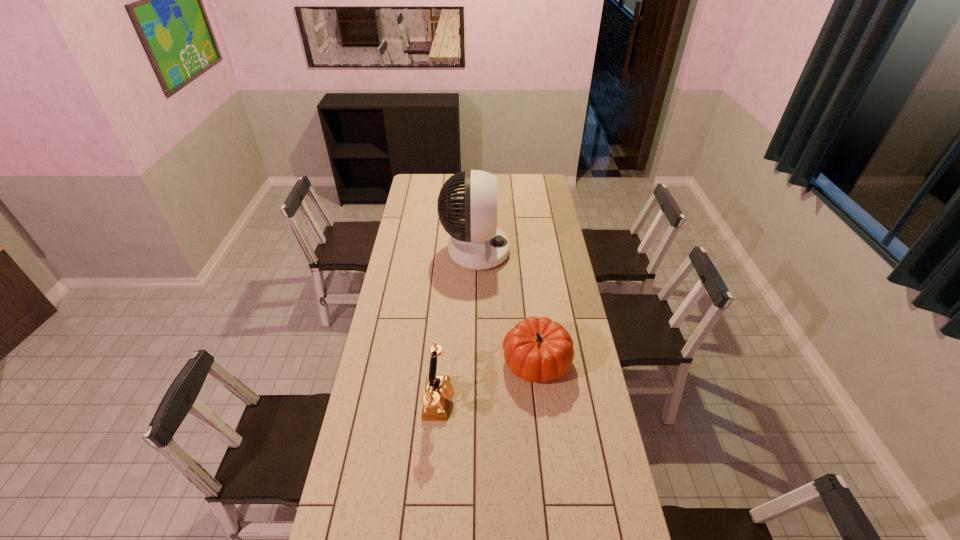
This screenshot has width=960, height=540. In order to click on the tallest object in this screenshot , I will do `click(470, 218)`.

What are the coordinates of `fan` in the screenshot? It's located at [470, 218].

What are the coordinates of `telephone` in the screenshot? It's located at click(x=438, y=390).

At what (x,y) coordinates should I click in order to perform the action: click on pumpkin. Please return your answer as a coordinate pair (x, y). The width and height of the screenshot is (960, 540). Looking at the image, I should click on (537, 349).

Locate an element on the screen. The height and width of the screenshot is (540, 960). free space located 0.180m on the grille of the fan is located at coordinates (543, 251).

Locate an element on the screen. The image size is (960, 540). free space located 0.310m on the dial of the telephone is located at coordinates (537, 400).

The width and height of the screenshot is (960, 540). I want to click on free space located 0.260m on the back of the pumpkin, so click(529, 294).

The width and height of the screenshot is (960, 540). What are the coordinates of `object that is at the right edge` in the screenshot? It's located at (537, 349).

Where is `blank area at the left edge`? blank area at the left edge is located at coordinates (406, 309).

In the image, there is a desktop. Where is `vacant space at the right edge`? The image size is (960, 540). vacant space at the right edge is located at coordinates (632, 538).